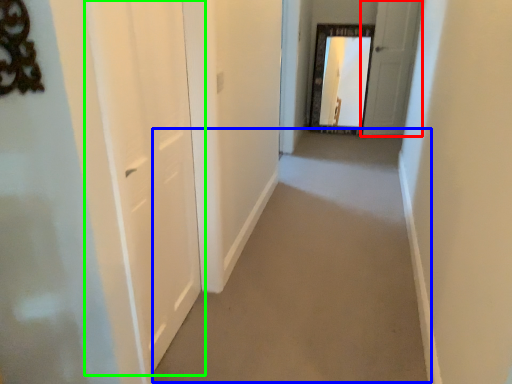
Question: Which object is the closest to the door (highlighted by a red box)? Choose among these: path (highlighted by a blue box) or door (highlighted by a green box).

Choices:
 (A) path
 (B) door

Answer: (A)